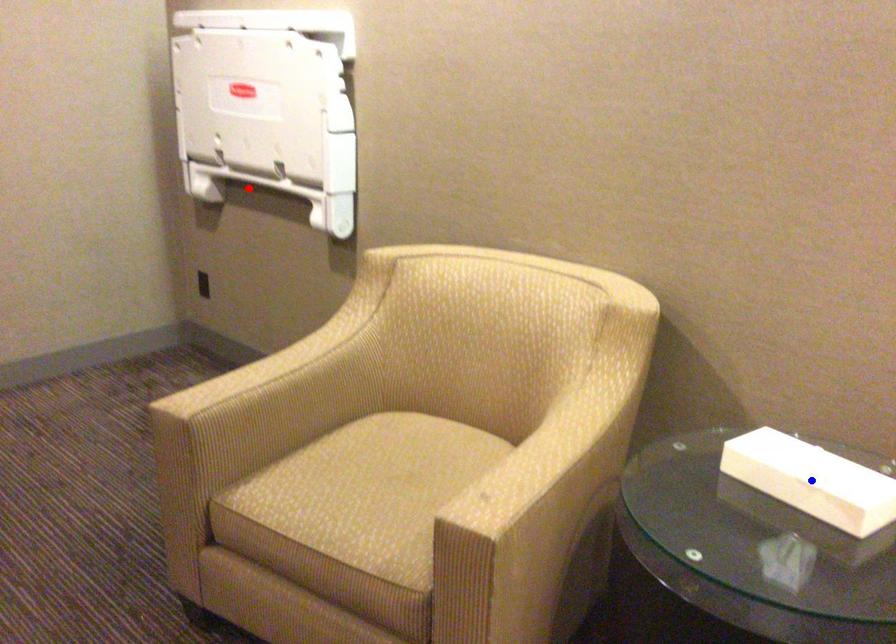
Question: Two points are marked on the image. Which point is closer to the camera?

Choices:
 (A) Blue point is closer.
 (B) Red point is closer.

Answer: (A)